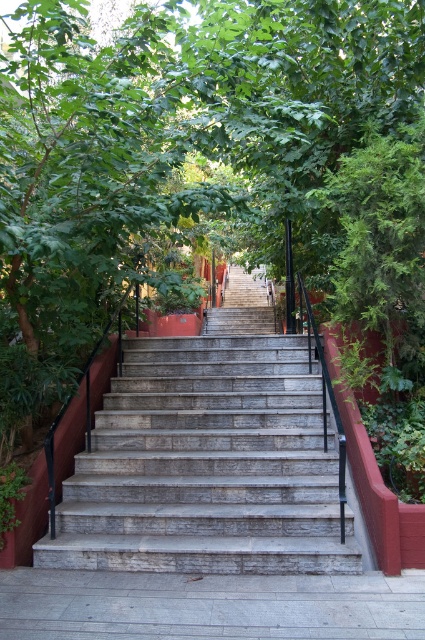
You are standing at the bottom of the gray stone stairs at center and want to reach the green leafy tree at center. Which direction should you move to get closer to the tree?

The green leafy tree at center is closer to the viewer than the gray stone stairs at center, so you are already closer to the tree than the stairs. To reach the tree, you should move upward along the gray stone stairs at center towards the tree.